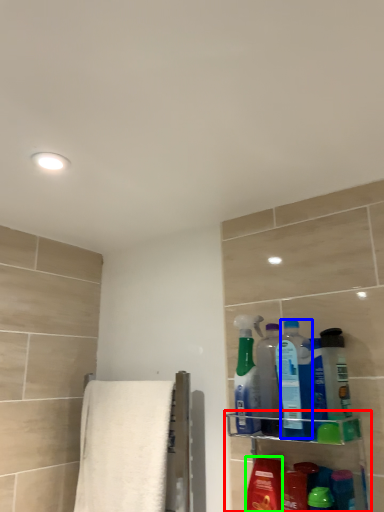
Question: Which object is the farthest from shelf (highlighted by a red box)? Choose among these: cleaning product (highlighted by a blue box) or mouthwash (highlighted by a green box).

Choices:
 (A) cleaning product
 (B) mouthwash

Answer: (A)